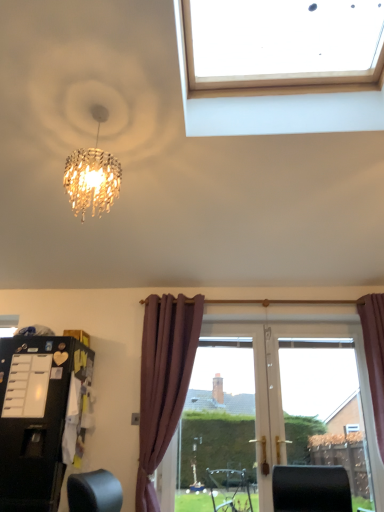
Question: Does black matte refrigerator at lower left have a lesser height compared to purple velvet curtain at right?

Choices:
 (A) no
 (B) yes

Answer: (B)

Question: From a real-world perspective, is black matte refrigerator at lower left located higher than purple velvet curtain at right?

Choices:
 (A) yes
 (B) no

Answer: (B)

Question: Is black matte refrigerator at lower left bigger than purple velvet curtain at right?

Choices:
 (A) yes
 (B) no

Answer: (A)

Question: Considering the relative sizes of black matte refrigerator at lower left and purple velvet curtain at right in the image provided, is black matte refrigerator at lower left thinner than purple velvet curtain at right?

Choices:
 (A) yes
 (B) no

Answer: (B)

Question: Is purple velvet curtain at right at the back of black matte refrigerator at lower left?

Choices:
 (A) yes
 (B) no

Answer: (B)

Question: From a real-world perspective, is black matte refrigerator at lower left below purple velvet curtain at right?

Choices:
 (A) no
 (B) yes

Answer: (B)

Question: Is purple velvet curtain at right looking in the opposite direction of black matte refrigerator at lower left?

Choices:
 (A) no
 (B) yes

Answer: (A)

Question: Is purple velvet curtain at right next to black matte refrigerator at lower left?

Choices:
 (A) yes
 (B) no

Answer: (B)

Question: Is purple velvet curtain at right taller than black matte refrigerator at lower left?

Choices:
 (A) yes
 (B) no

Answer: (A)

Question: From a real-world perspective, is purple velvet curtain at right physically above black matte refrigerator at lower left?

Choices:
 (A) yes
 (B) no

Answer: (A)

Question: Can you confirm if purple velvet curtain at right is wider than black matte refrigerator at lower left?

Choices:
 (A) no
 (B) yes

Answer: (A)

Question: Can you confirm if purple velvet curtain at right is shorter than black matte refrigerator at lower left?

Choices:
 (A) yes
 (B) no

Answer: (B)

Question: In terms of width, does purple velvet curtain at right look wider or thinner when compared to black matte refrigerator at lower left?

Choices:
 (A) wide
 (B) thin

Answer: (B)